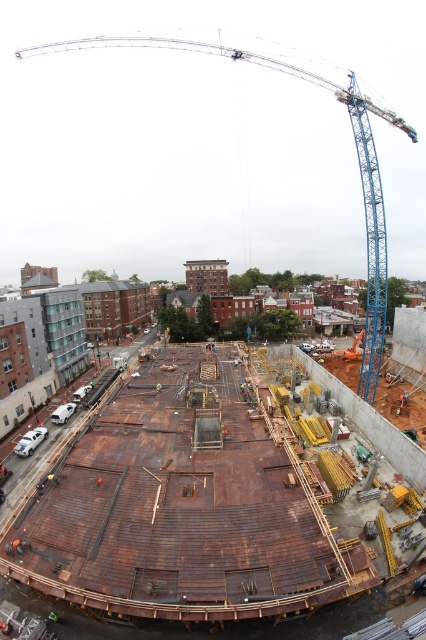
You are an engineer inspecting a construction site from above. You notice the rusty wood construction site at center and the blue metallic crane at upper center. Which object is located higher in the image?

The blue metallic crane at upper center is higher in the image because it is positioned above the rusty wood construction site at center.

You are an architect observing the construction site from a nearby building. You notice the rusty wood construction site at center and the blue metallic crane at upper center. Which object is taller?

The blue metallic crane at upper center is taller than the rusty wood construction site at center.

From the picture: You are a construction worker who needs to move a heavy beam from the rusty wood construction site at center to the blue metallic crane at upper center. Which direction should you move the beam to reach the crane?

The rusty wood construction site at center is to the left of the blue metallic crane at upper center, so you should move the beam to the right to reach the crane.